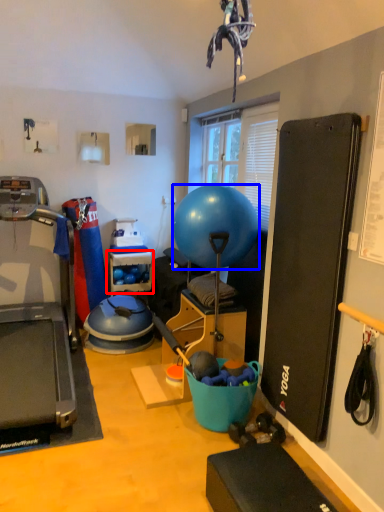
Question: Which of the following is the farthest to the observer, shelf (highlighted by a red box) or ball (highlighted by a blue box)?

Choices:
 (A) shelf
 (B) ball

Answer: (A)